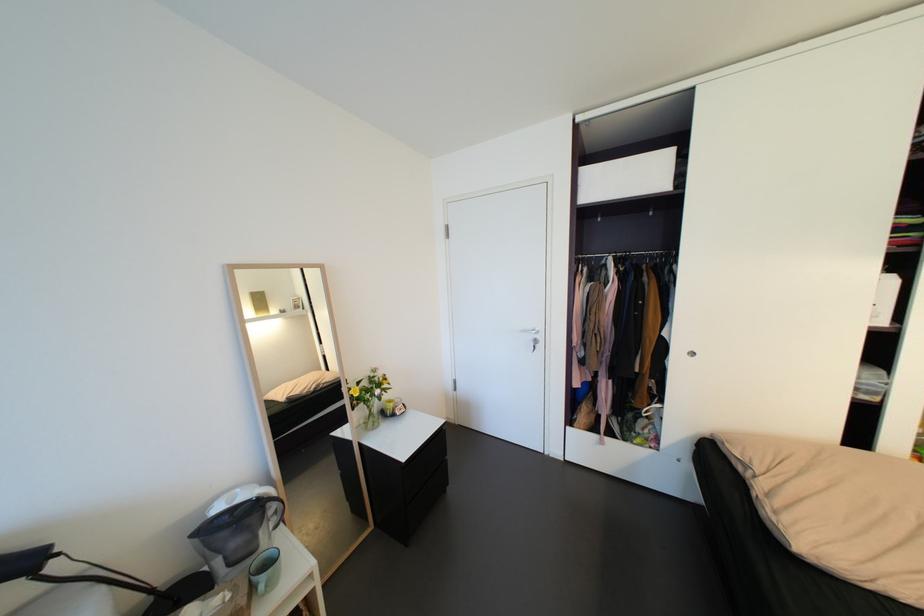
The width and height of the screenshot is (924, 616). What do you see at coordinates (771, 554) in the screenshot?
I see `a sofa sitting surface` at bounding box center [771, 554].